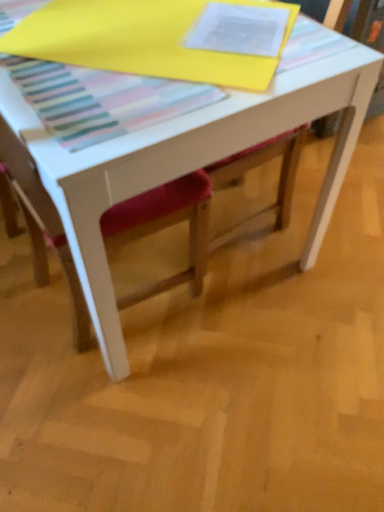
Question: Does point (97, 181) appear closer or farther from the camera than point (157, 214)?

Choices:
 (A) closer
 (B) farther

Answer: (A)

Question: Is white matte table at center to the left or to the right of velvet red chair at center in the image?

Choices:
 (A) left
 (B) right

Answer: (B)

Question: From the image's perspective, is white matte table at center located above or below velvet red chair at center?

Choices:
 (A) above
 (B) below

Answer: (A)

Question: Does point (36, 253) appear closer or farther from the camera than point (110, 297)?

Choices:
 (A) farther
 (B) closer

Answer: (A)

Question: Would you say velvet red chair at center is to the left or to the right of white matte table at center in the picture?

Choices:
 (A) right
 (B) left

Answer: (B)

Question: Considering the positions of velvet red chair at center and white matte table at center in the image, is velvet red chair at center taller or shorter than white matte table at center?

Choices:
 (A) short
 (B) tall

Answer: (B)

Question: From a real-world perspective, relative to white matte table at center, is velvet red chair at center vertically above or below?

Choices:
 (A) below
 (B) above

Answer: (B)